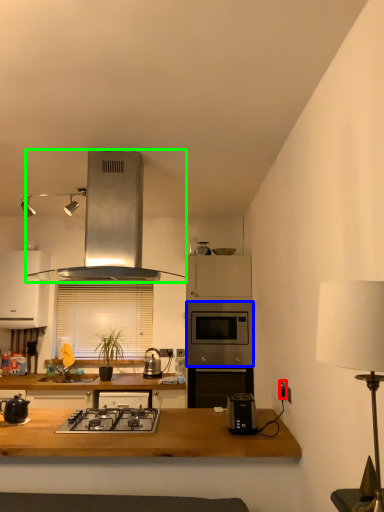
Question: Which object is positioned closest to electric outlet (highlighted by a red box)? Select from oven (highlighted by a blue box) and kitchen appliance (highlighted by a green box).

Choices:
 (A) oven
 (B) kitchen appliance

Answer: (A)